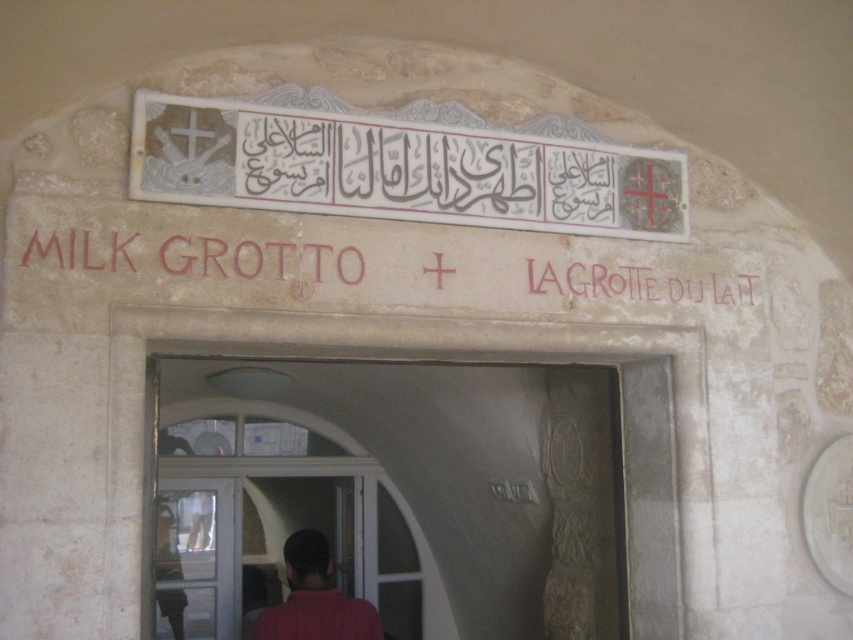
You are standing at the entrance of the Milk Grotto and want to place a small offering at the two points marked in the image. The first point is at coordinate point (184, 636) and the second is at point (293, 554). Since you can only move forward in a straight line, which point should you reach first?

You should reach point (293, 554) first because it is in front of point (184, 636). Since you can only move forward in a straight line, the closer point will be encountered first.

You are standing at the entrance of the Milk Grotto and want to take a photo of both the white stone signboard at upper center and the red matte shirt at center. If your camera can focus on objects within a 5 feet range, will both objects be in focus?

The white stone signboard at upper center is 6.51 feet away from the red matte shirt at center. Since the distance between them is more than 5 feet, the camera cannot focus on both objects simultaneously within the 5 feet range.

You are standing at the entrance of the Milk Grotto and notice two items of interest. One is the white stone signboard at upper center, and the other is the red matte shirt at center. Which of these items is positioned higher up?

The white stone signboard at upper center is positioned higher up than the red matte shirt at center.